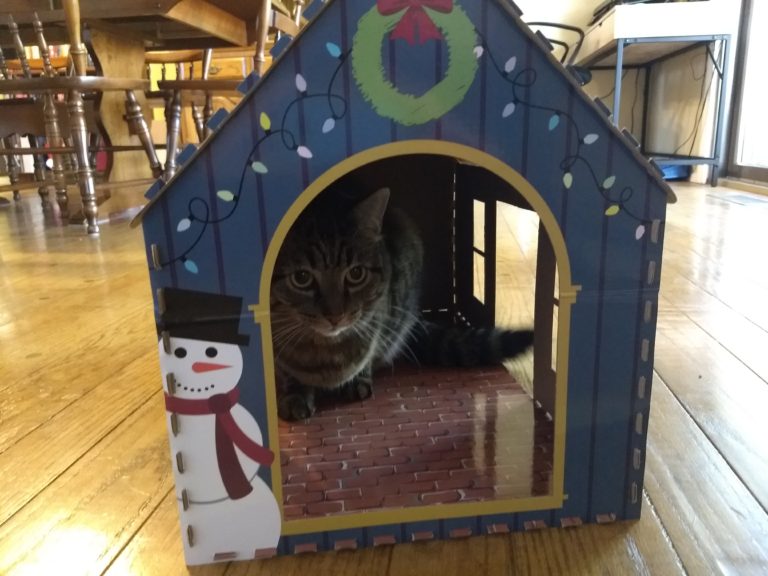
Locate an element on the screen. The image size is (768, 576). wreath on cat house is located at coordinates (452, 93).